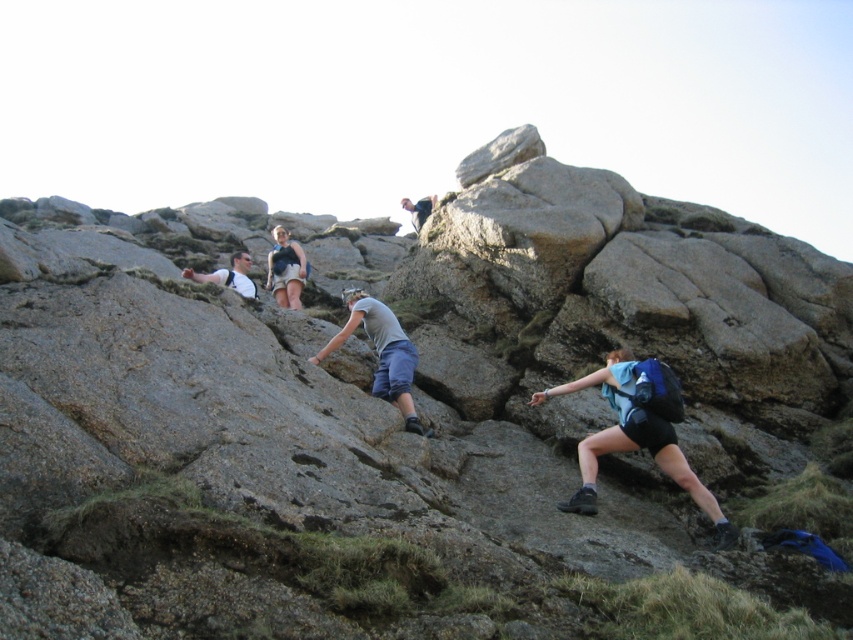
Question: Based on their relative distances, which object is farther from the gray fabric pants at center?

Choices:
 (A) matte gray shirt at lower left
 (B) blue fabric backpack at lower right

Answer: (A)

Question: Does blue fabric backpack at lower right come in front of matte gray shirt at lower left?

Choices:
 (A) yes
 (B) no

Answer: (A)

Question: Where is gray fabric pants at center located in relation to matte gray shirt at lower left in the image?

Choices:
 (A) below
 (B) above

Answer: (A)

Question: Which object is the closest to the matte gray shirt at lower left?

Choices:
 (A) blue fabric backpack at lower right
 (B) gray fabric pants at center

Answer: (B)

Question: Does gray fabric pants at center appear under matte gray shirt at lower left?

Choices:
 (A) no
 (B) yes

Answer: (B)

Question: Estimate the real-world distances between objects in this image. Which object is farther from the blue fabric backpack at lower right?

Choices:
 (A) gray fabric pants at center
 (B) matte gray shirt at lower left

Answer: (B)